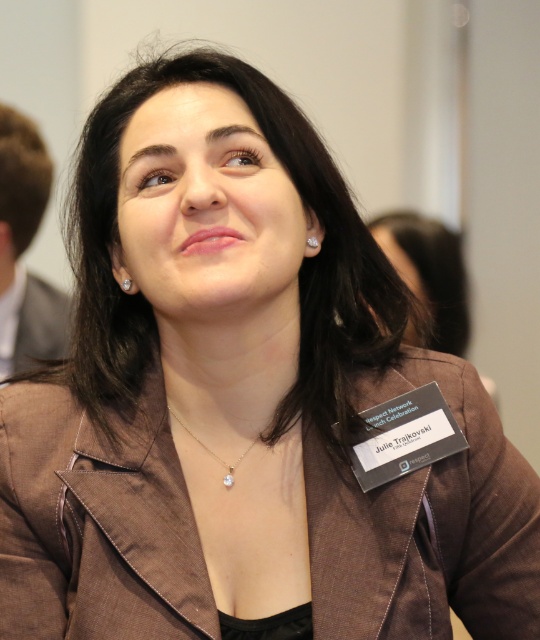
Question: Can you confirm if white cotton shirt at left is positioned to the left of clear crystal pendant at center?

Choices:
 (A) no
 (B) yes

Answer: (B)

Question: Which object appears closest to the camera in this image?

Choices:
 (A) clear crystal pendant at center
 (B) white cotton shirt at left

Answer: (A)

Question: Observing the image, what is the correct spatial positioning of white cotton shirt at left in reference to clear crystal pendant at center?

Choices:
 (A) right
 (B) left

Answer: (B)

Question: Does white cotton shirt at left have a greater width compared to clear crystal pendant at center?

Choices:
 (A) no
 (B) yes

Answer: (A)

Question: Which object appears farthest from the camera in this image?

Choices:
 (A) white cotton shirt at left
 (B) clear crystal pendant at center

Answer: (A)

Question: Which object appears closest to the camera in this image?

Choices:
 (A) clear crystal pendant at center
 (B) white cotton shirt at left

Answer: (A)